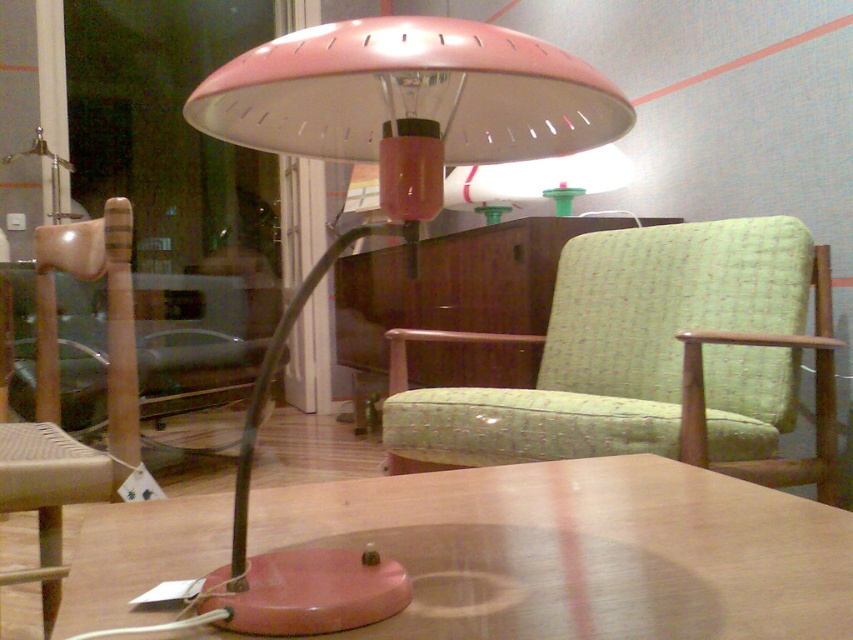
Between green fabric swivel chair at center and pink matte table lamp at center, which one has more height?

green fabric swivel chair at center

Is green fabric swivel chair at center thinner than pink matte table lamp at center?

Incorrect, green fabric swivel chair at center's width is not less than pink matte table lamp at center's.

Does point (595, 445) come closer to viewer compared to point (257, 378)?

Yes, it is.

The width and height of the screenshot is (853, 640). Identify the location of green fabric swivel chair at center. (650, 358).

Is matte pink table at center below pink matte table lamp at center?

Yes.

Does matte pink table at center appear over pink matte table lamp at center?

No.

Identify the location of matte pink table at center. This screenshot has width=853, height=640. (583, 552).

Is matte pink table at center bigger than green fabric swivel chair at center?

Actually, matte pink table at center might be smaller than green fabric swivel chair at center.

What are the coordinates of `matte pink table at center` in the screenshot? It's located at (583, 552).

The height and width of the screenshot is (640, 853). I want to click on matte pink table at center, so 583,552.